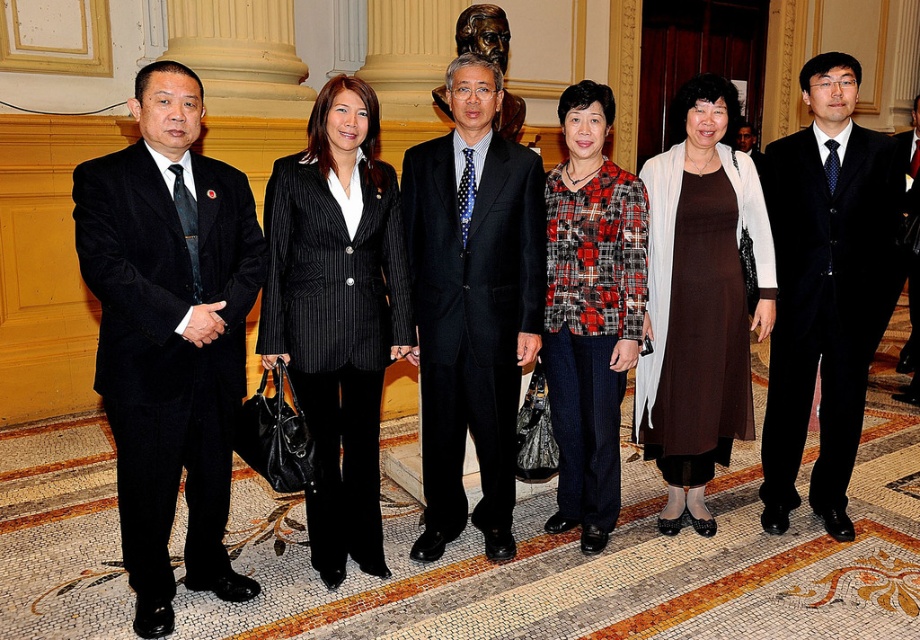
Measure the distance between black wool suit at left and polka dot tie at center.

A distance of 32.12 inches exists between black wool suit at left and polka dot tie at center.

Which of these two, black wool suit at left or polka dot tie at center, stands taller?

With more height is polka dot tie at center.

Which is in front, point (193, 337) or point (491, 518)?

Positioned in front is point (193, 337).

Identify the location of black wool suit at left. (169, 333).

In the scene shown: Who is more forward, (365, 136) or (651, 429)?

Point (365, 136) is in front.

Which is in front, point (289, 161) or point (711, 188)?

Point (289, 161) is in front.

Where is `black pinstripe suit at center`? Image resolution: width=920 pixels, height=640 pixels. black pinstripe suit at center is located at coordinates (337, 314).

Can you confirm if polka dot tie at center is positioned to the right of black pinstripe suit at center?

Correct, you'll find polka dot tie at center to the right of black pinstripe suit at center.

Can you confirm if polka dot tie at center is shorter than black pinstripe suit at center?

Incorrect, polka dot tie at center's height does not fall short of black pinstripe suit at center's.

You are a GUI agent. You are given a task and a screenshot of the screen. Output one action in this format:
    pyautogui.click(x=<x>, y=<y>)
    Task: Click on the polka dot tie at center
    The width and height of the screenshot is (920, 640).
    Given the screenshot: What is the action you would take?
    pyautogui.click(x=472, y=301)